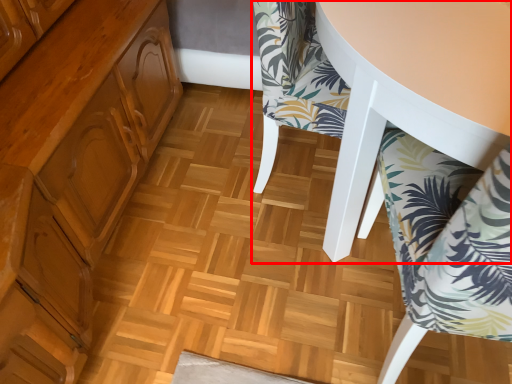
Question: From the image's perspective, where is chair (annotated by the red box) located in relation to chair in the image?

Choices:
 (A) below
 (B) above

Answer: (B)